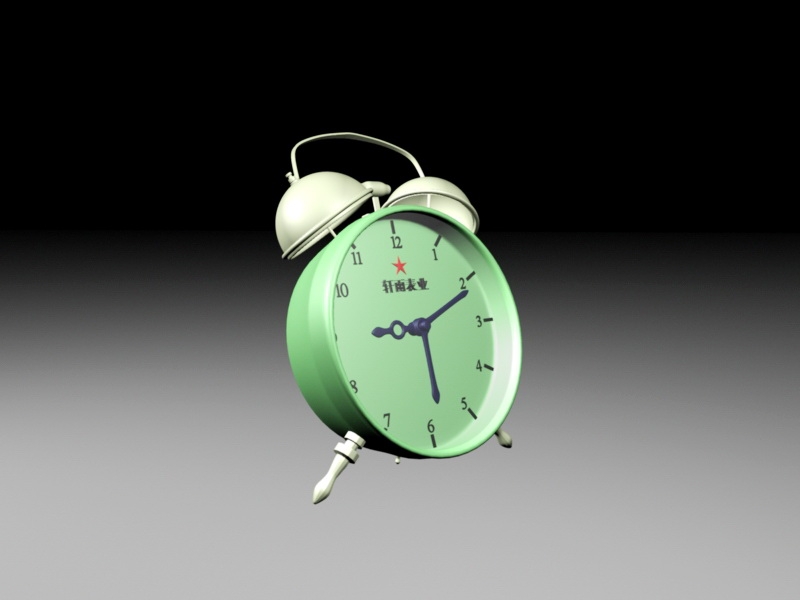
Where is `feet of alarm clock`? feet of alarm clock is located at coordinates (334, 471), (502, 438).